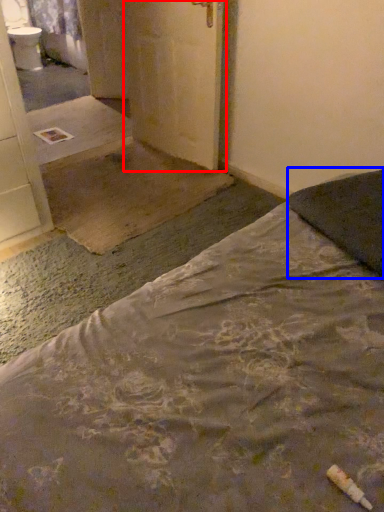
Question: Which object is closer to the camera taking this photo, door (highlighted by a red box) or pillow (highlighted by a blue box)?

Choices:
 (A) door
 (B) pillow

Answer: (B)